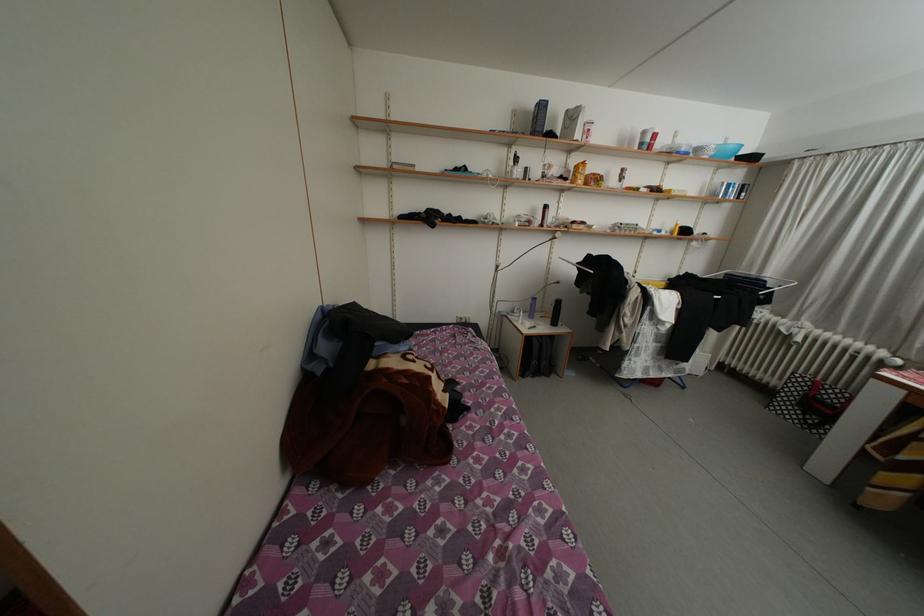
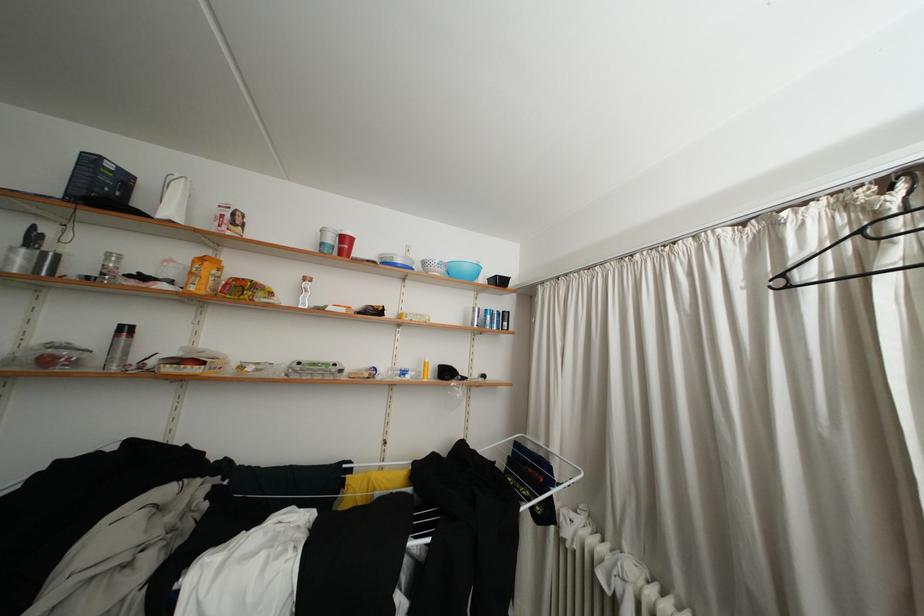
In the second image, find the point that corresponds to pixel 761 278 in the first image.

(550, 448)